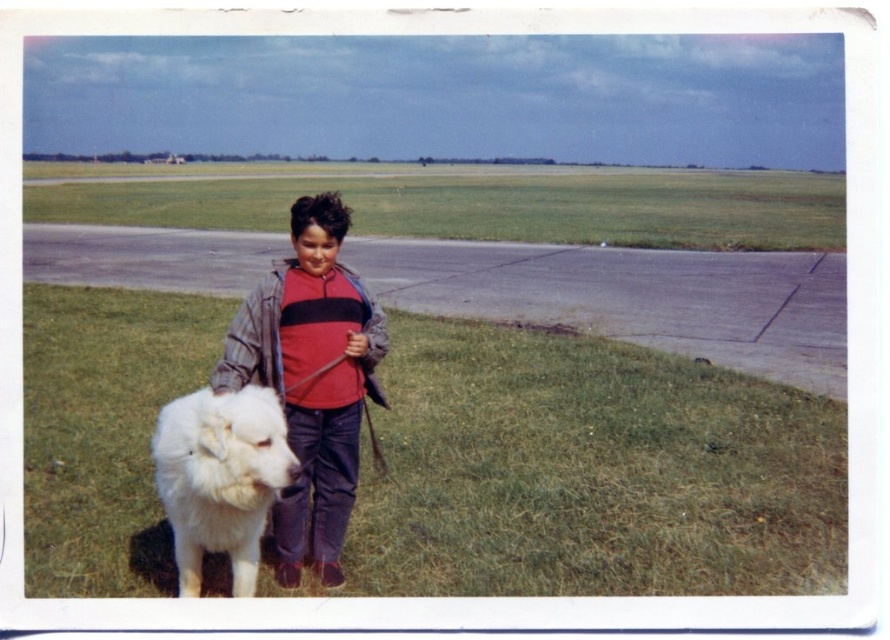
You are a drone operator who needs to land a drone on the gray asphalt runway at center. The drone is currently 10 meters above the runway. If the drone descends vertically at a constant speed of 0.5 meters per second, how many seconds will it take for the drone to reach the runway?

The gray asphalt runway at center is 7.52 meters away from the camera. However, the drone is 10 meters above the runway. Since the runway is at ground level, the vertical distance the drone needs to descend is 10 meters. At a speed of 0.5 meters per second, it would take 10 divided by 0.5, which equals 20 seconds. Therefore, the drone will take 20 seconds to land on the gray asphalt runway at center.

You are a pilot preparing to land a small airplane on the gray asphalt runway at center. You notice a white fluffy dog at lower left nearby. Based on their positions, will the dog be in the direct path of the airplane as it lands?

The gray asphalt runway at center is to the left of the white fluffy dog at lower left, so the dog is positioned to the right side of the runway. Therefore, the dog would be in the direct path of the airplane as it lands on the runway.

You are a drone operator preparing to land a drone on the gray asphalt runway at center. You notice a white fluffy dog at lower left nearby. Is the runway tall enough to safely land the drone without it hitting the dog?

The gray asphalt runway at center is taller than the white fluffy dog at lower left, so the drone can land safely on the runway without hitting the dog.